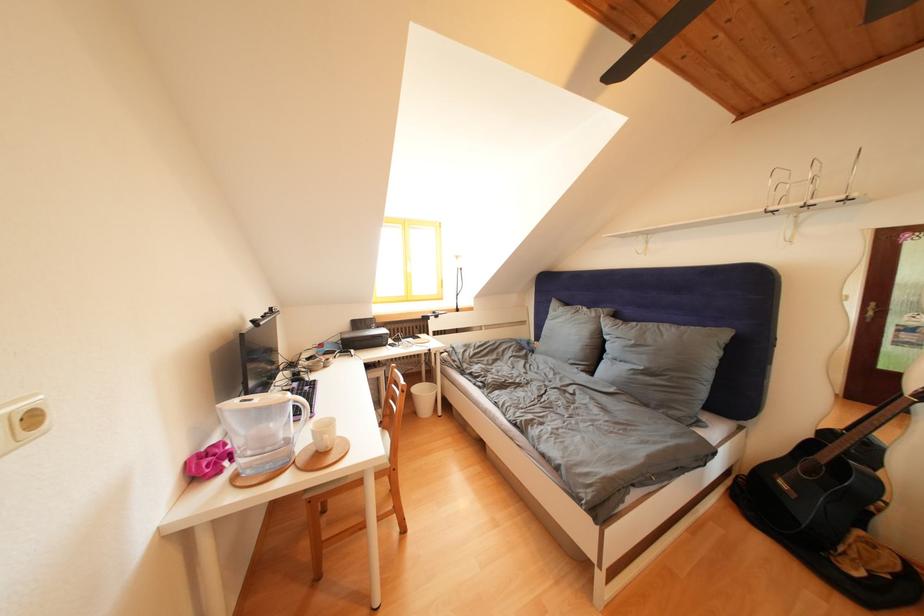
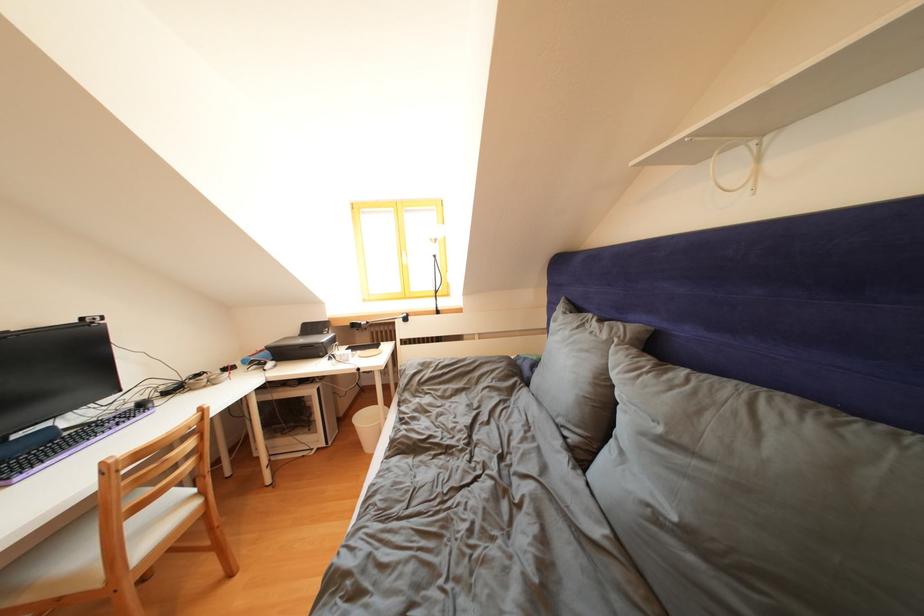
The images are taken continuously from a first-person perspective. In which direction are you moving?

The cameraman walked toward right, forward.